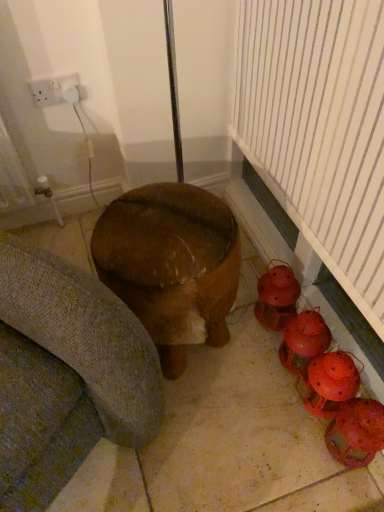
Question: Is matte red lantern at lower right, marked as the 4th toy in a top-to-bottom arrangement, outside white plastic socket at upper left?

Choices:
 (A) no
 (B) yes

Answer: (B)

Question: Does matte red lantern at lower right, acting as the 1th toy starting from the bottom, lie behind white plastic socket at upper left?

Choices:
 (A) yes
 (B) no

Answer: (B)

Question: Can you confirm if matte red lantern at lower right, marked as the 4th toy in a top-to-bottom arrangement, is taller than white plastic socket at upper left?

Choices:
 (A) no
 (B) yes

Answer: (B)

Question: Considering the relative sizes of matte red lantern at lower right, acting as the 1th toy starting from the bottom, and white plastic socket at upper left in the image provided, is matte red lantern at lower right, acting as the 1th toy starting from the bottom, wider than white plastic socket at upper left?

Choices:
 (A) yes
 (B) no

Answer: (A)

Question: From a real-world perspective, is matte red lantern at lower right, acting as the 1th toy starting from the bottom, beneath white plastic socket at upper left?

Choices:
 (A) yes
 (B) no

Answer: (A)

Question: Is white plastic socket at upper left to the left or to the right of matte red lantern at lower right, the 3th toy from the bottom, in the image?

Choices:
 (A) left
 (B) right

Answer: (A)

Question: Is point (41, 82) closer or farther from the camera than point (304, 349)?

Choices:
 (A) farther
 (B) closer

Answer: (A)

Question: Considering their positions, is white plastic socket at upper left located in front of or behind matte red lantern at lower right, the 3th toy from the bottom?

Choices:
 (A) front
 (B) behind

Answer: (B)

Question: Is white plastic socket at upper left bigger or smaller than matte red lantern at lower right, the 3th toy from the bottom?

Choices:
 (A) small
 (B) big

Answer: (A)

Question: From the image's perspective, is matte red lantern at lower right, the 2th toy viewed from the top, positioned above or below matte red lantern at lower right, marked as the 4th toy in a top-to-bottom arrangement?

Choices:
 (A) below
 (B) above

Answer: (B)

Question: Is matte red lantern at lower right, the 2th toy viewed from the top, wider or thinner than matte red lantern at lower right, marked as the 4th toy in a top-to-bottom arrangement?

Choices:
 (A) wide
 (B) thin

Answer: (B)

Question: From their relative heights in the image, would you say matte red lantern at lower right, the 3th toy from the bottom, is taller or shorter than matte red lantern at lower right, acting as the 1th toy starting from the bottom?

Choices:
 (A) tall
 (B) short

Answer: (A)

Question: Considering the positions of point (314, 318) and point (347, 458), is point (314, 318) closer or farther from the camera than point (347, 458)?

Choices:
 (A) farther
 (B) closer

Answer: (A)

Question: From their relative heights in the image, would you say matte orange lanterns at lower right, arranged as the third toy when viewed from the top, is taller or shorter than wooden stool at center?

Choices:
 (A) short
 (B) tall

Answer: (A)

Question: Relative to wooden stool at center, is matte orange lanterns at lower right, placed as the second toy when sorted from bottom to top, in front or behind?

Choices:
 (A) behind
 (B) front

Answer: (A)